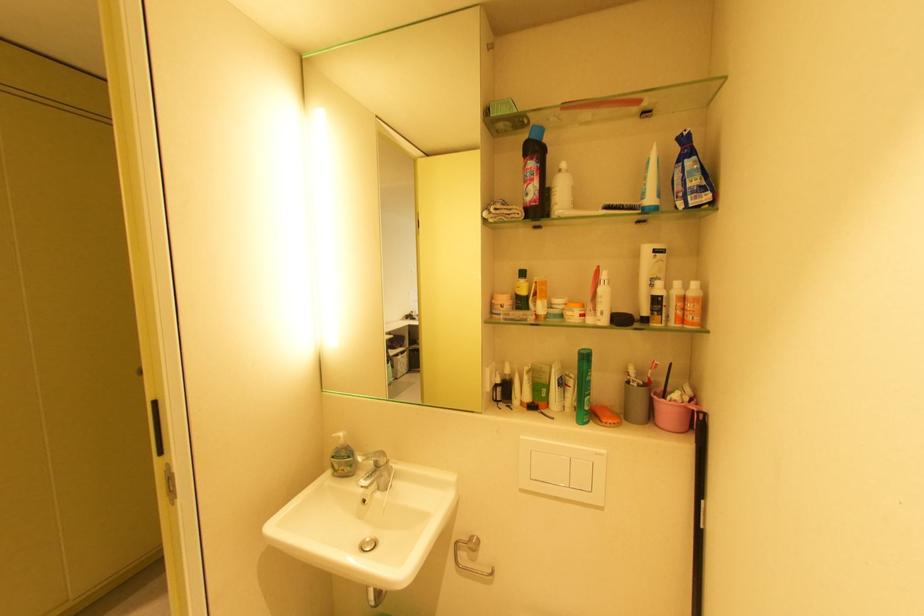
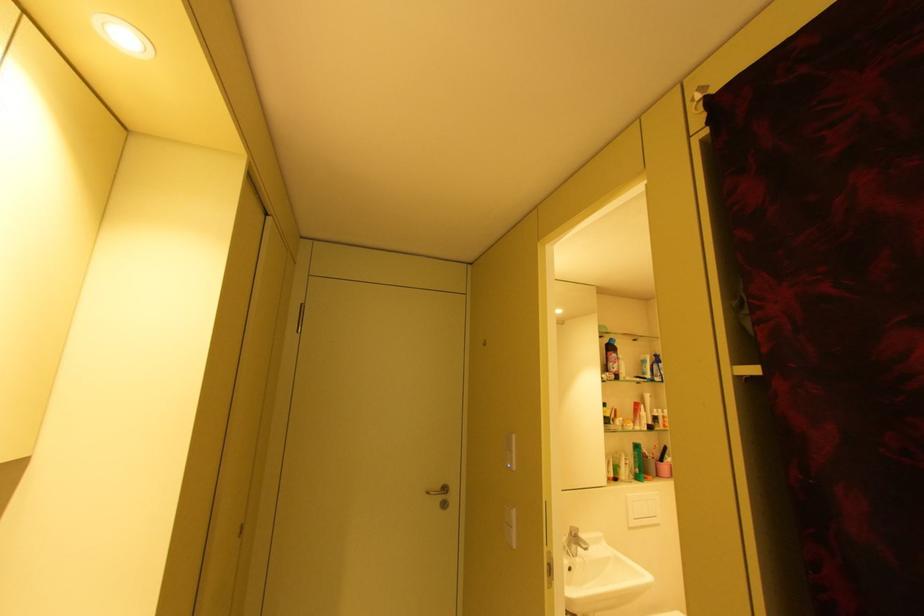
In the second image, find the point that corresponds to the point at 684,151 in the first image.

(661, 359)